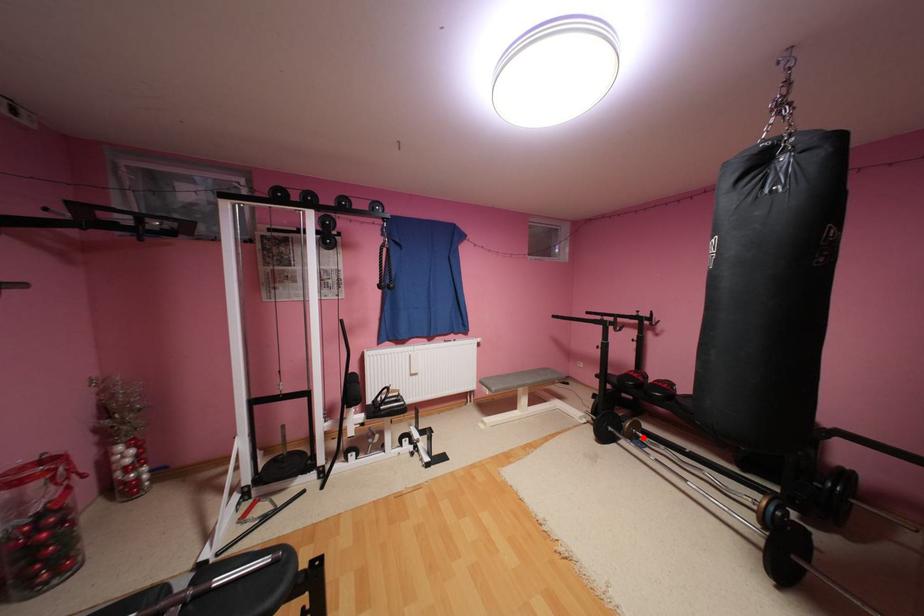
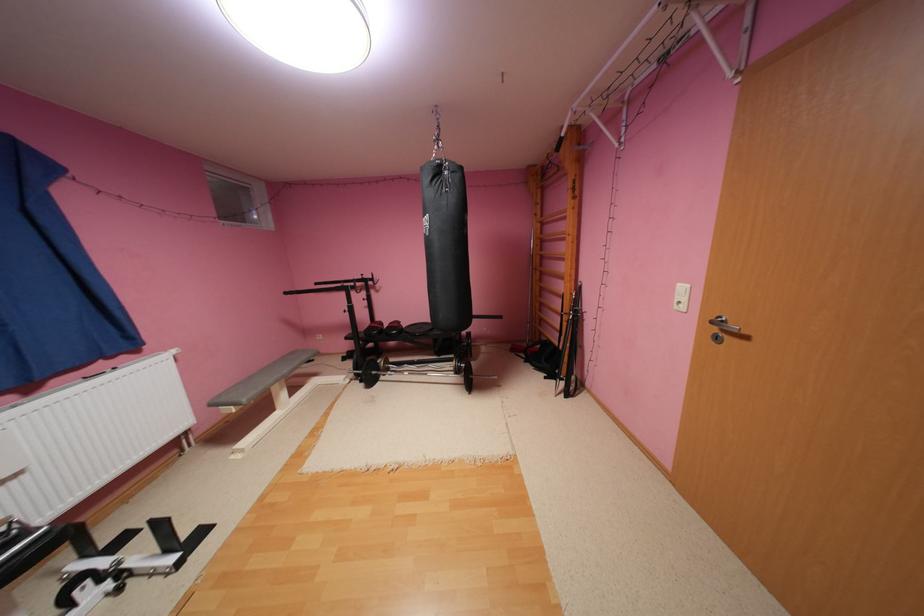
Question: I am providing you with two images of the same scene from different viewpoints. Image1 has a red point marked. In image2, the corresponding 3D location appears at what relative position? Reply with the corresponding letter.

Choices:
 (A) Closer
 (B) Farther

Answer: (A)